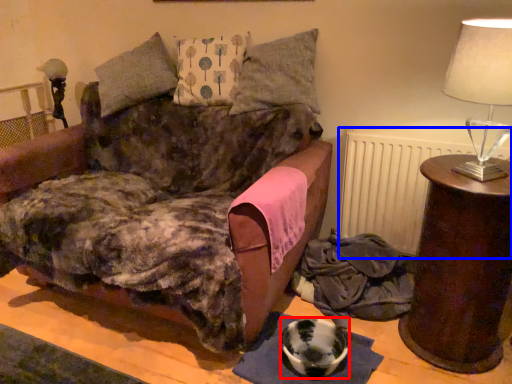
Question: Which object appears farthest to the camera in this image, bowl (highlighted by a red box) or radiator (highlighted by a blue box)?

Choices:
 (A) bowl
 (B) radiator

Answer: (B)